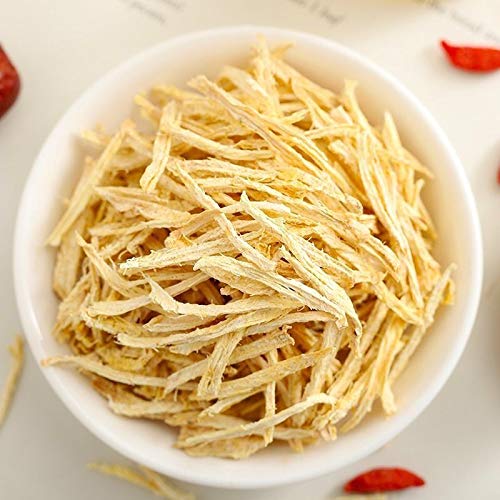
Find the location of a particular element. tabletop background is located at coordinates (452, 430).